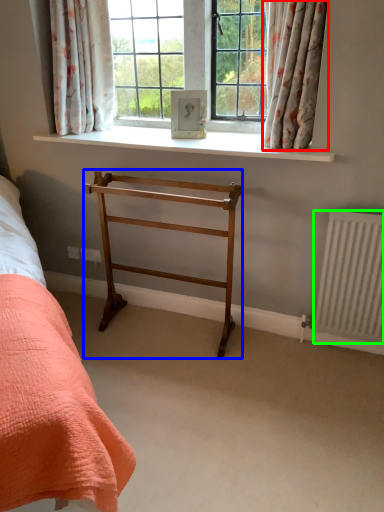
Question: Which is nearer to the curtain (highlighted by a red box)? furniture (highlighted by a blue box) or radiator (highlighted by a green box).

Choices:
 (A) furniture
 (B) radiator

Answer: (A)